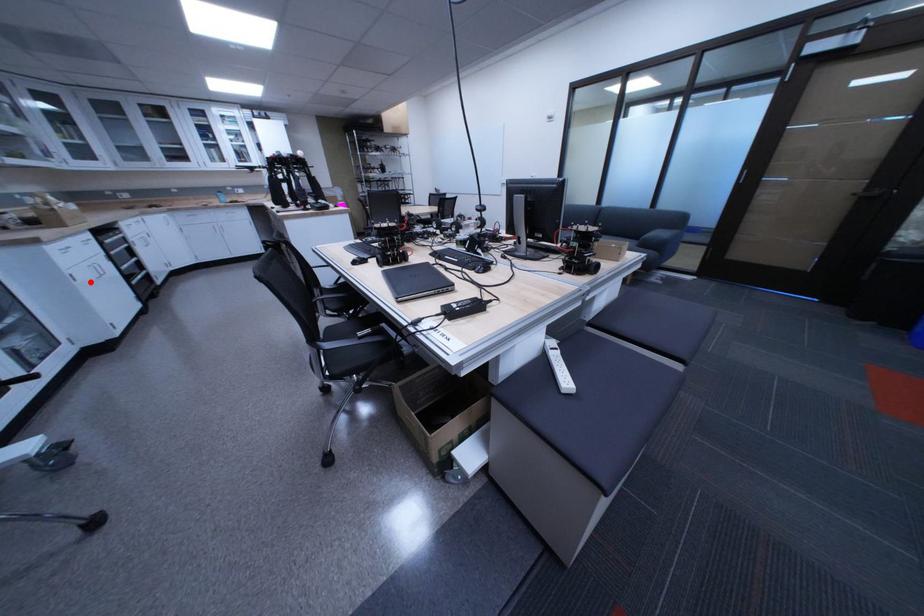
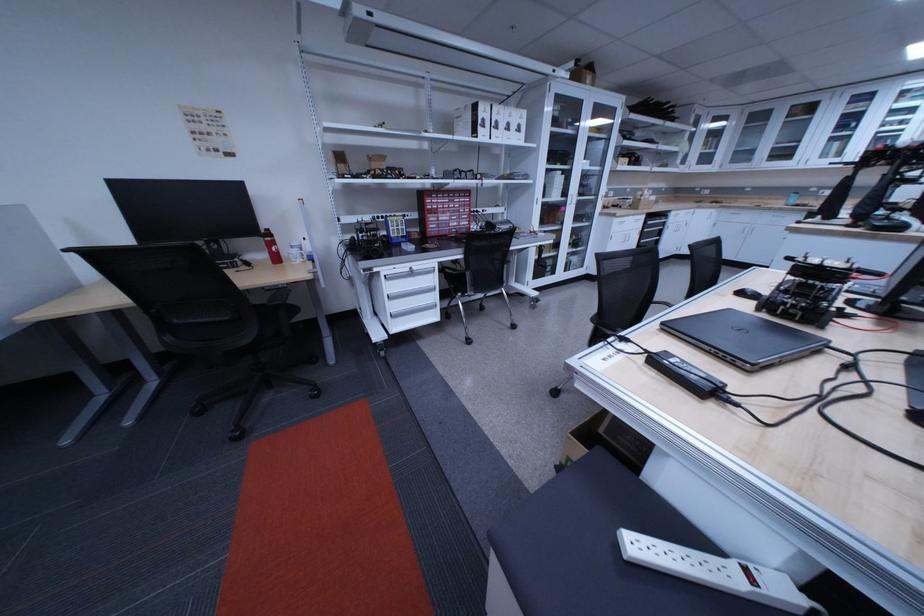
The point at the highlighted location is marked in the first image. Where is the corresponding point in the second image?

(626, 241)